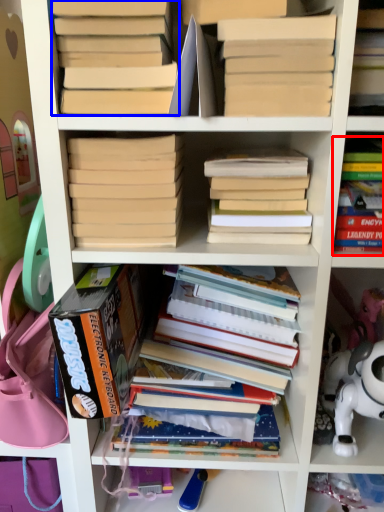
Question: Which point is closer to the camera, book (highlighted by a red box) or book (highlighted by a blue box)?

Choices:
 (A) book
 (B) book

Answer: (B)